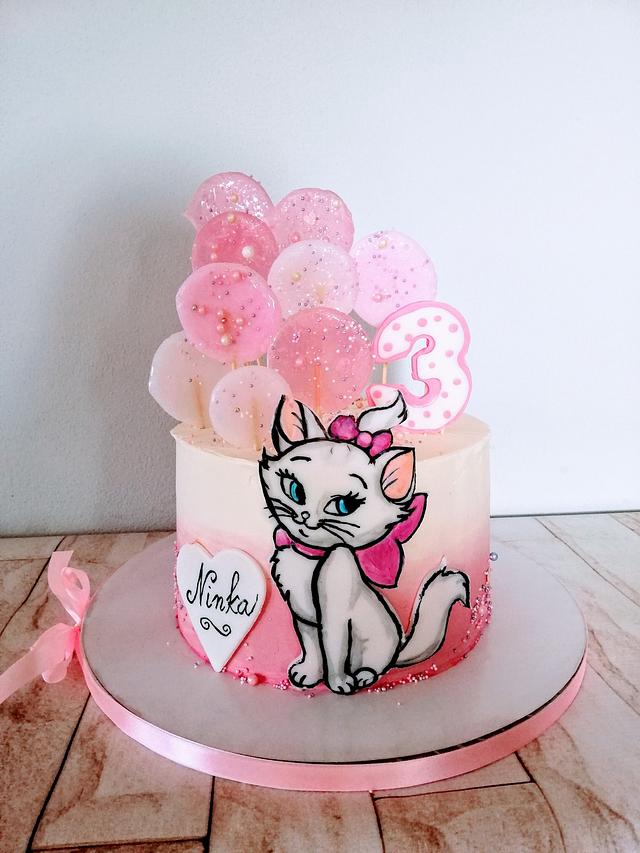
This screenshot has height=853, width=640. I want to click on wooden surface, so click(x=127, y=811).